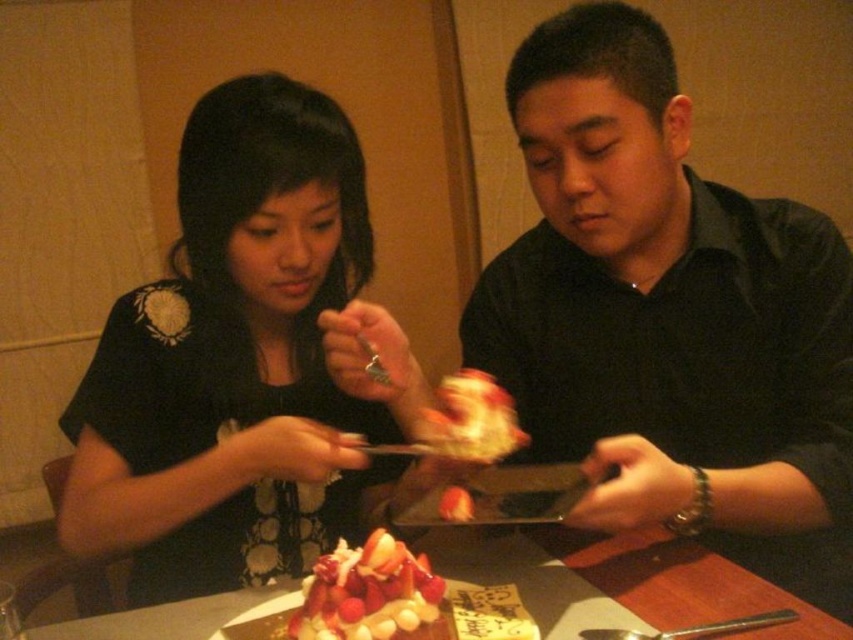
You are a waiter at a restaurant and need to place a new dessert order between the wooden table at center and the slightly blurred white cake at center. Which object should you place it closer to to ensure it is visible to both guests?

The wooden table at center is in front of the slightly blurred white cake at center, so placing the dessert order closer to the wooden table at center would make it visible to both guests.

You are a chef who needs to place a new dessert plate on the wooden table at center. The dessert plate has a diameter of 25 cm. Can you fit it on the table without overlapping the slightly blurred white cake at center?

The wooden table at center is bigger than the slightly blurred white cake at center, so yes, the dessert plate with a diameter of 25 cm can be placed on the wooden table at center without overlapping the slightly blurred white cake at center as there is enough space available.

You are a waiter who needs to place a 7.5 inch wide dessert plate on the table. Can you fit it between the wooden table at center and the frosted white cake at center without touching the cake?

The wooden table at center and frosted white cake at center are 6.75 inches apart. Since the dessert plate is 7.5 inches wide, it cannot fit in the space between them without overlapping the cake. Therefore, the plate cannot be placed there without touching the cake.